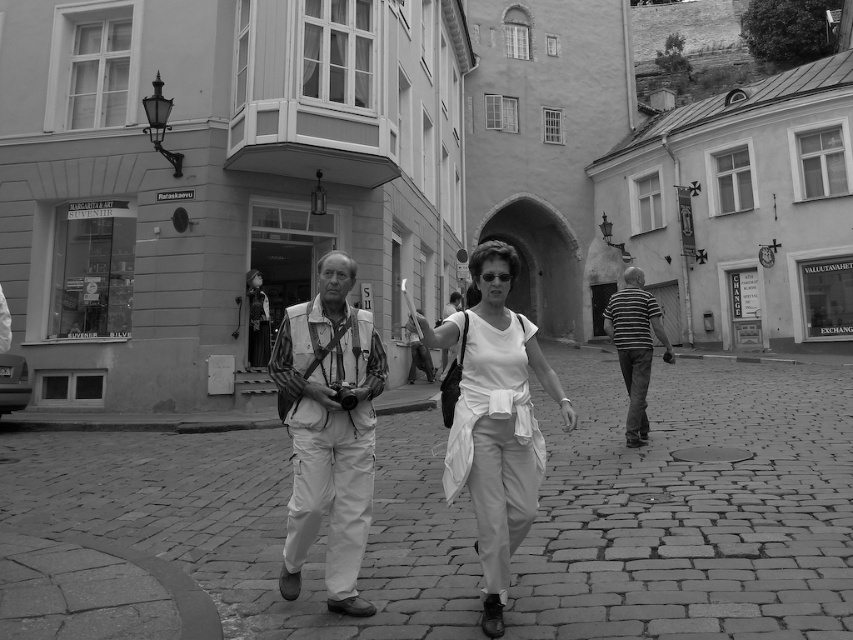
You are a tailor observing two garments in the image. The matte white vest at center and the striped cotton shirt at center. Which garment is shorter in height?

The matte white vest at center is shorter in height than the striped cotton shirt at center.

You are a tailor observing a couple walking in a historic town. You notice the matte white vest at center and the white cotton shirt at center. Which clothing item is positioned higher on their bodies?

The matte white vest at center is taller than the white cotton shirt at center, so the vest is positioned higher on their bodies.